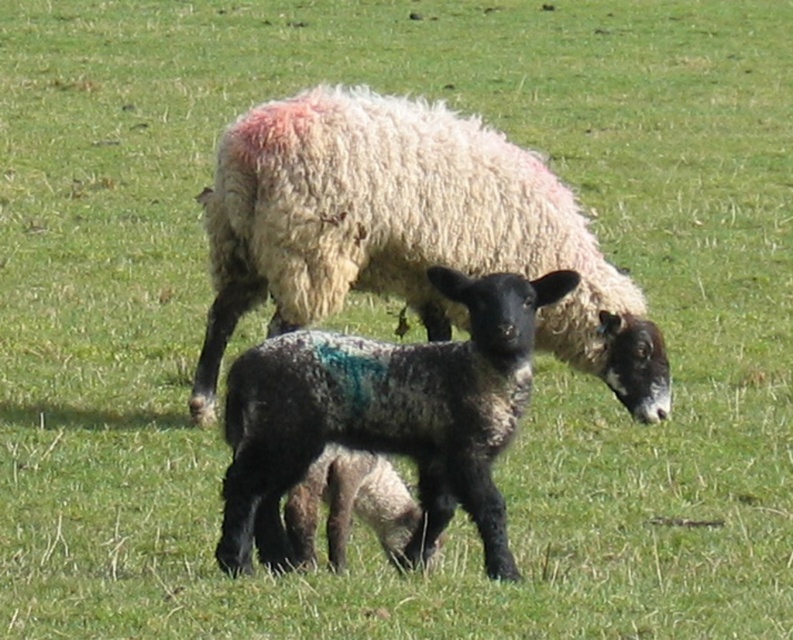
You are a farmer who wants to separate the white woolen sheep at center and the speckled wool lamb at center into different pens based on their sizes. Which pen should each animal go into, and why?

The white woolen sheep at center is much taller than the speckled wool lamb at center, so the white woolen sheep at center should go into the adult pen and the speckled wool lamb at center should go into the lamb pen.

You are a farmer looking at the field. You see the white woolen sheep at center and the speckled wool lamb at center. Which one is higher up in the image?

The white woolen sheep at center is above the speckled wool lamb at center, so the white woolen sheep at center is higher up in the image.